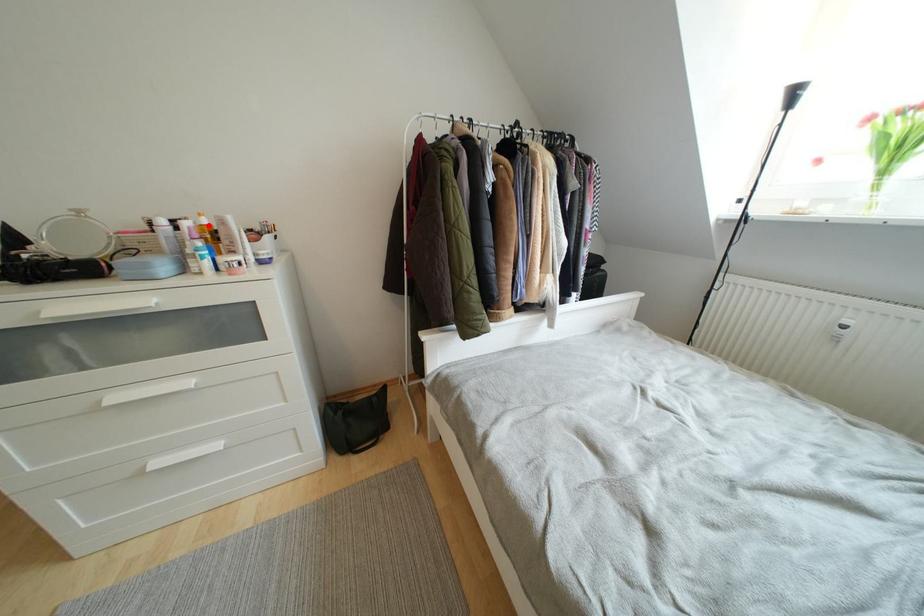
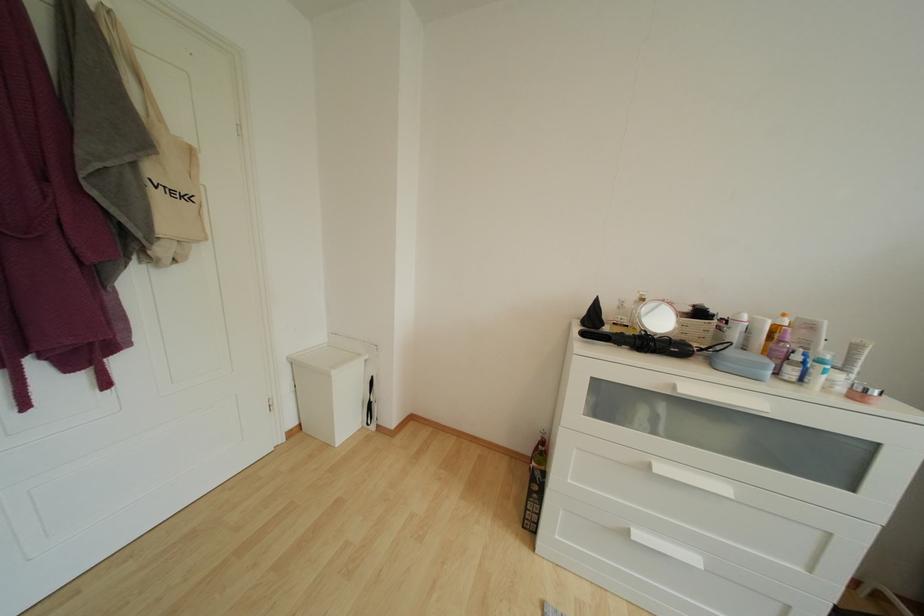
Find the pixel in the second image that matches the highlighted location in the first image.

(789, 326)